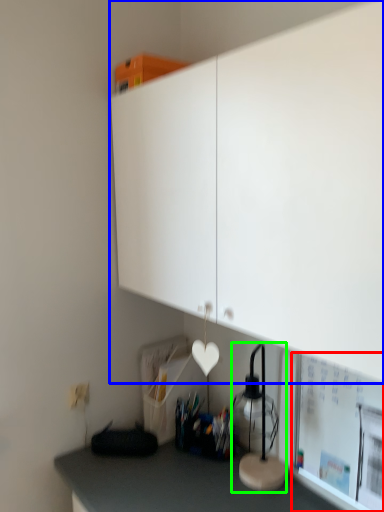
Question: Which object is positioned farthest from bulletin board (highlighted by a red box)? Select from cabinetry (highlighted by a blue box) and table lamp (highlighted by a green box).

Choices:
 (A) cabinetry
 (B) table lamp

Answer: (A)